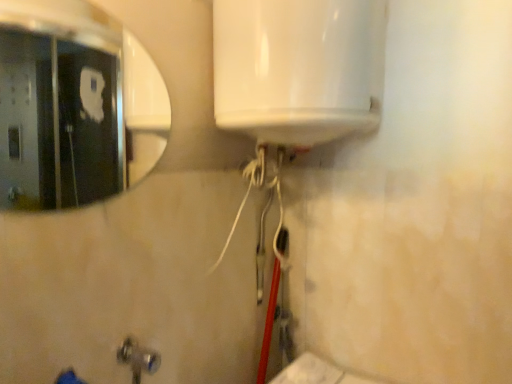
Question: Is point (118, 354) positioned closer to the camera than point (78, 84)?

Choices:
 (A) farther
 (B) closer

Answer: (B)

Question: Considering the positions of brushed metal faucet at lower left and silver/metallic mirror at upper left in the image, is brushed metal faucet at lower left bigger or smaller than silver/metallic mirror at upper left?

Choices:
 (A) big
 (B) small

Answer: (A)

Question: Considering the positions of brushed metal faucet at lower left and silver/metallic mirror at upper left in the image, is brushed metal faucet at lower left wider or thinner than silver/metallic mirror at upper left?

Choices:
 (A) wide
 (B) thin

Answer: (A)

Question: Looking at the image, does silver/metallic mirror at upper left seem bigger or smaller compared to brushed metal faucet at lower left?

Choices:
 (A) big
 (B) small

Answer: (B)

Question: Do you think silver/metallic mirror at upper left is within brushed metal faucet at lower left, or outside of it?

Choices:
 (A) inside
 (B) outside

Answer: (B)

Question: Considering the positions of point (77, 140) and point (134, 382), is point (77, 140) closer or farther from the camera than point (134, 382)?

Choices:
 (A) closer
 (B) farther

Answer: (B)

Question: From a real-world perspective, is silver/metallic mirror at upper left physically located above or below brushed metal faucet at lower left?

Choices:
 (A) above
 (B) below

Answer: (A)